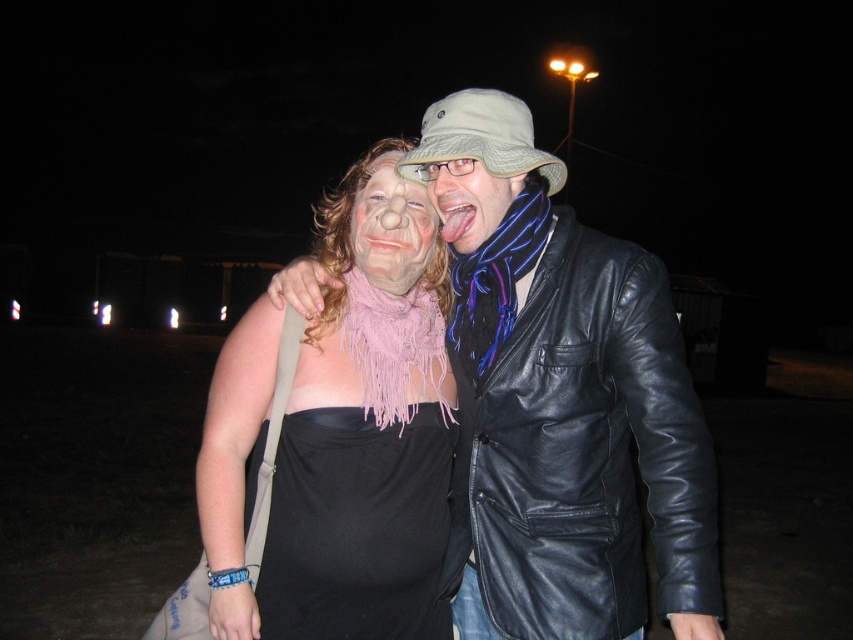
You are a photographer adjusting the camera settings for a night portrait. The camera has a focus range of 28 centimeters. You need to ensure both the black leather jacket at right and the black matte dress at center are in focus. Can the camera capture both objects clearly in the same frame?

The black leather jacket at right and black matte dress at center are 29.17 centimeters apart from each other. Since the camera has a focus range of 28 centimeters, the distance between them exceeds the focus range. Therefore, the camera cannot capture both objects clearly in the same frame.

You are trying to decide which jacket to wear tonight. You have both the black leather jacket at right and the matte black jacket at center. Based on the image, which jacket is wider?

The black leather jacket at right is wider than the matte black jacket at center according to the description.

You are trying to locate the black leather jacket at right in the image. What are the coordinates where it is positioned?

The black leather jacket at right is located at coordinates point [584,451].